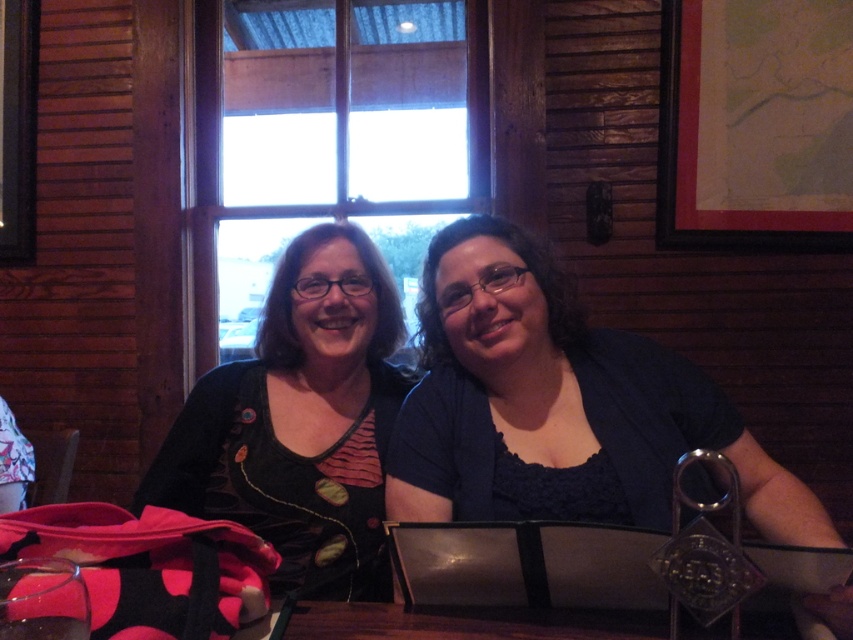
Question: Which object is positioned closest to the dark blue fabric shirt at center?

Choices:
 (A) black velvet shirt at center
 (B) transparent glass at lower left

Answer: (A)

Question: Which object is closer to the camera taking this photo?

Choices:
 (A) dark blue fabric shirt at center
 (B) transparent glass at lower left

Answer: (B)

Question: Which object appears closest to the camera in this image?

Choices:
 (A) black velvet shirt at center
 (B) dark blue fabric shirt at center
 (C) transparent glass at lower left

Answer: (C)

Question: Does dark blue fabric shirt at center have a lesser width compared to black velvet shirt at center?

Choices:
 (A) no
 (B) yes

Answer: (A)

Question: Can you confirm if black velvet shirt at center is smaller than transparent glass at lower left?

Choices:
 (A) no
 (B) yes

Answer: (A)

Question: Observing the image, what is the correct spatial positioning of black velvet shirt at center in reference to transparent glass at lower left?

Choices:
 (A) below
 (B) above

Answer: (B)